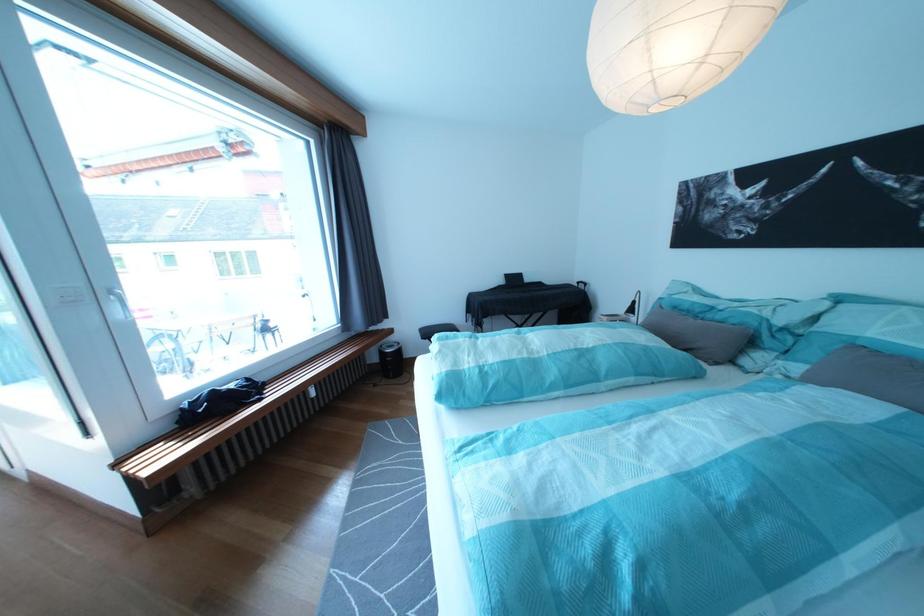
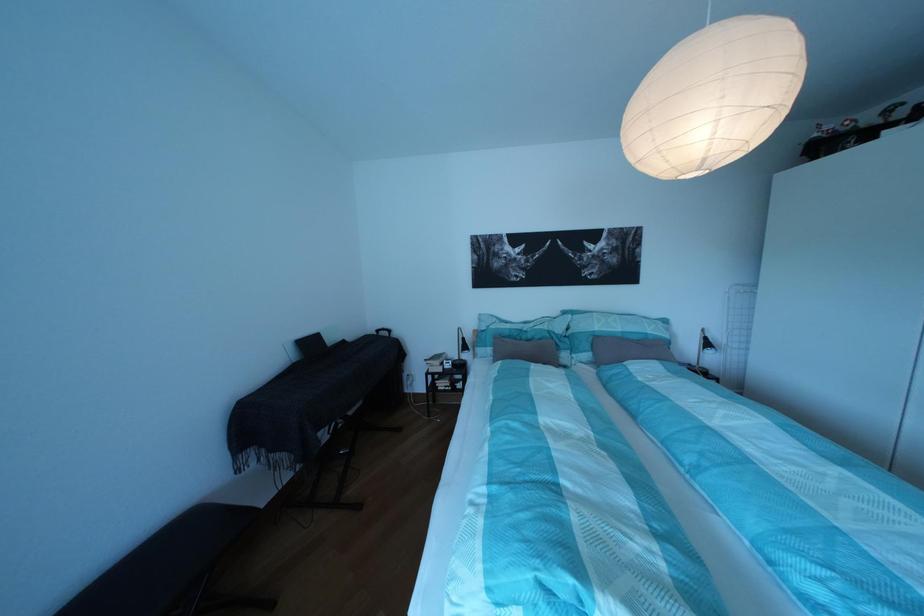
Where in the second image is the point corresponding to (723,322) from the first image?

(538, 342)